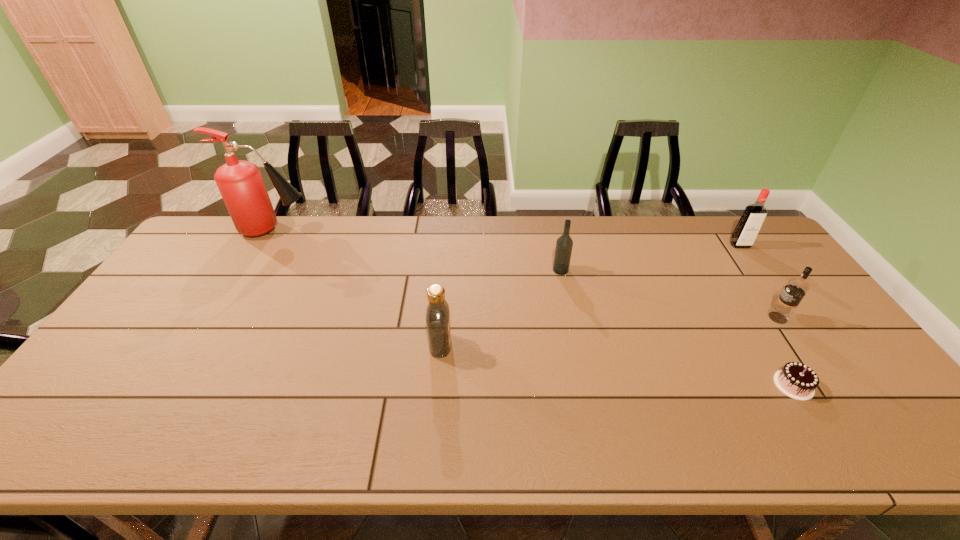
This screenshot has width=960, height=540. I want to click on vacant position in the image that satisfies the following two spatial constraints: 1. on the back side of the chocolate cake; 2. with the nozzle aimed from the tallest object, so click(x=697, y=229).

You are a GUI agent. You are given a task and a screenshot of the screen. Output one action in this format:
    pyautogui.click(x=<x>, y=<y>)
    Task: Click on the free space that satisfies the following two spatial constraints: 1. with the nozzle aimed from the fourth object from left to right; 2. on the left side of the leftmost object
    The height and width of the screenshot is (540, 960).
    Given the screenshot: What is the action you would take?
    pyautogui.click(x=183, y=385)

Locate an element on the screen. free spot that satisfies the following two spatial constraints: 1. with the nozzle aimed from the farthest object; 2. on the back side of the fourth object from left to right is located at coordinates (183, 385).